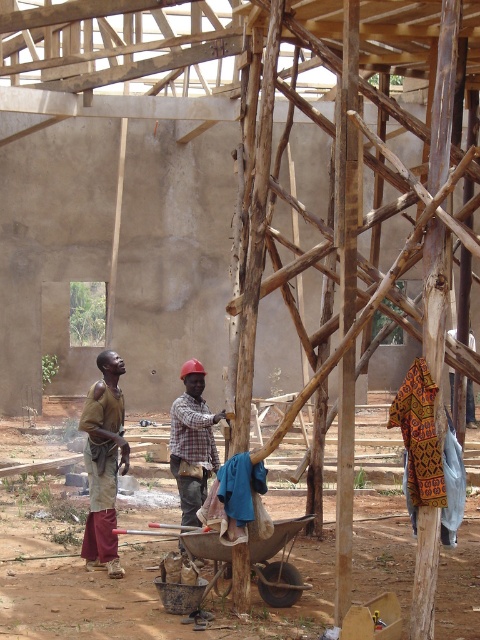
Who is positioned more to the right, brown fabric at left or plaid fabric shirt at center?

Positioned to the right is plaid fabric shirt at center.

Is brown fabric at left positioned at the back of plaid fabric shirt at center?

No, it is not.

Does point (103, 449) come closer to viewer compared to point (192, 488)?

No, (103, 449) is behind (192, 488).

The image size is (480, 640). Find the location of `brown fabric at left`. brown fabric at left is located at coordinates (104, 461).